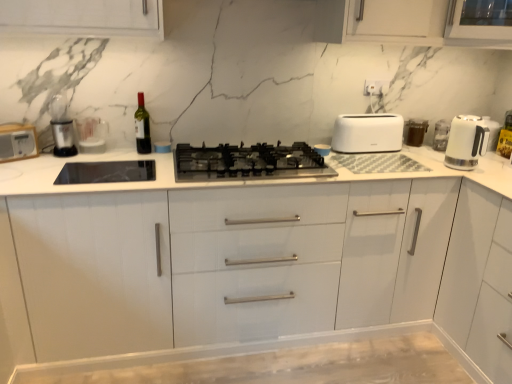
Question: Can white plastic toaster at left be found inside matte glass wine bottle at center?

Choices:
 (A) yes
 (B) no

Answer: (B)

Question: Can you see matte glass wine bottle at center touching white plastic toaster at left?

Choices:
 (A) no
 (B) yes

Answer: (A)

Question: Considering the relative sizes of matte glass wine bottle at center and white plastic toaster at left in the image provided, is matte glass wine bottle at center shorter than white plastic toaster at left?

Choices:
 (A) yes
 (B) no

Answer: (B)

Question: Considering the relative sizes of matte glass wine bottle at center and white plastic toaster at left in the image provided, is matte glass wine bottle at center wider than white plastic toaster at left?

Choices:
 (A) no
 (B) yes

Answer: (B)

Question: Can you confirm if matte glass wine bottle at center is positioned to the right of white plastic toaster at left?

Choices:
 (A) yes
 (B) no

Answer: (A)

Question: Would you say white plastic toaster at left is to the left or to the right of brown matte container at upper right in the picture?

Choices:
 (A) right
 (B) left

Answer: (B)

Question: Considering their positions, is white plastic toaster at left located in front of or behind brown matte container at upper right?

Choices:
 (A) behind
 (B) front

Answer: (B)

Question: From the image's perspective, is white plastic toaster at left positioned above or below brown matte container at upper right?

Choices:
 (A) below
 (B) above

Answer: (A)

Question: Is point (27, 155) closer or farther from the camera than point (421, 137)?

Choices:
 (A) closer
 (B) farther

Answer: (A)

Question: Do you think white glossy electric kettle at right is within white plastic toaster at left, or outside of it?

Choices:
 (A) outside
 (B) inside

Answer: (A)

Question: In terms of width, does white glossy electric kettle at right look wider or thinner when compared to white plastic toaster at left?

Choices:
 (A) thin
 (B) wide

Answer: (B)

Question: In the image, is white glossy electric kettle at right positioned in front of or behind white plastic toaster at left?

Choices:
 (A) behind
 (B) front

Answer: (A)

Question: Is point (453, 148) positioned closer to the camera than point (11, 142)?

Choices:
 (A) closer
 (B) farther

Answer: (B)

Question: Is white matte cabinet at right to the left or to the right of white glossy electric kettle at right in the image?

Choices:
 (A) left
 (B) right

Answer: (B)

Question: From the image's perspective, is white matte cabinet at right above or below white glossy electric kettle at right?

Choices:
 (A) below
 (B) above

Answer: (A)